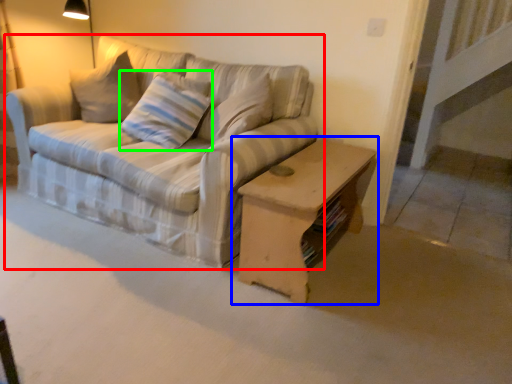
Question: Considering the real-world distances, which object is farthest from studio couch (highlighted by a red box)? table (highlighted by a blue box) or pillow (highlighted by a green box)?

Choices:
 (A) table
 (B) pillow

Answer: (A)